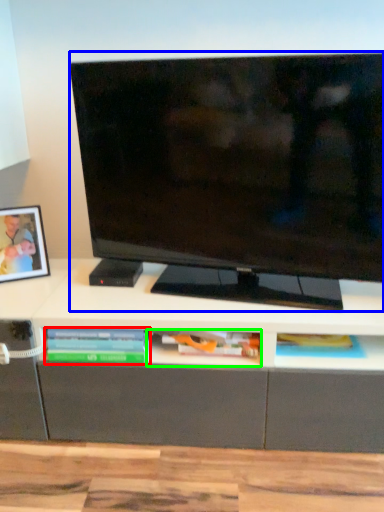
Question: Considering the real-world distances, which object is closest to book (highlighted by a red box)? television (highlighted by a blue box) or book (highlighted by a green box).

Choices:
 (A) television
 (B) book

Answer: (B)